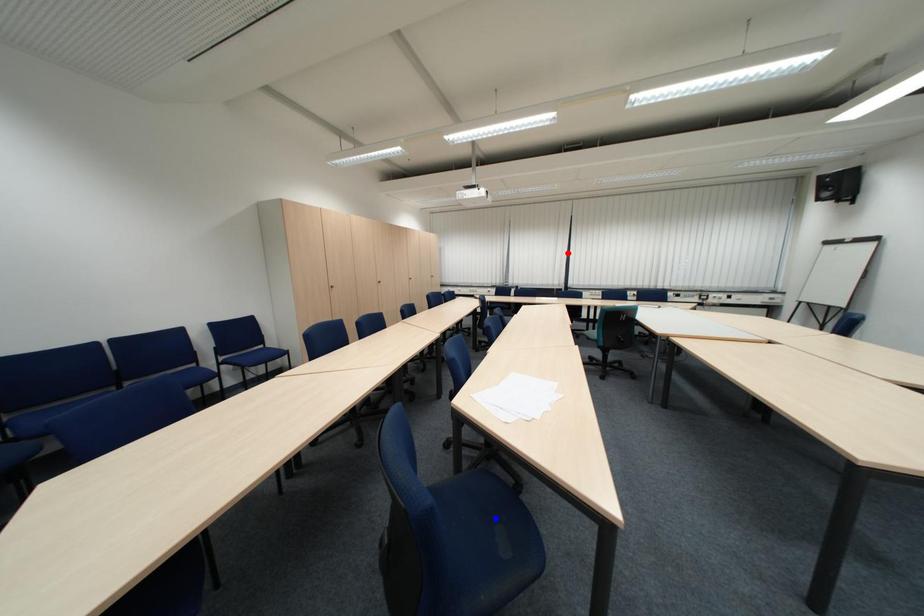
Question: Which of the two points in the image is closer to the camera?

Choices:
 (A) Blue point is closer.
 (B) Red point is closer.

Answer: (A)